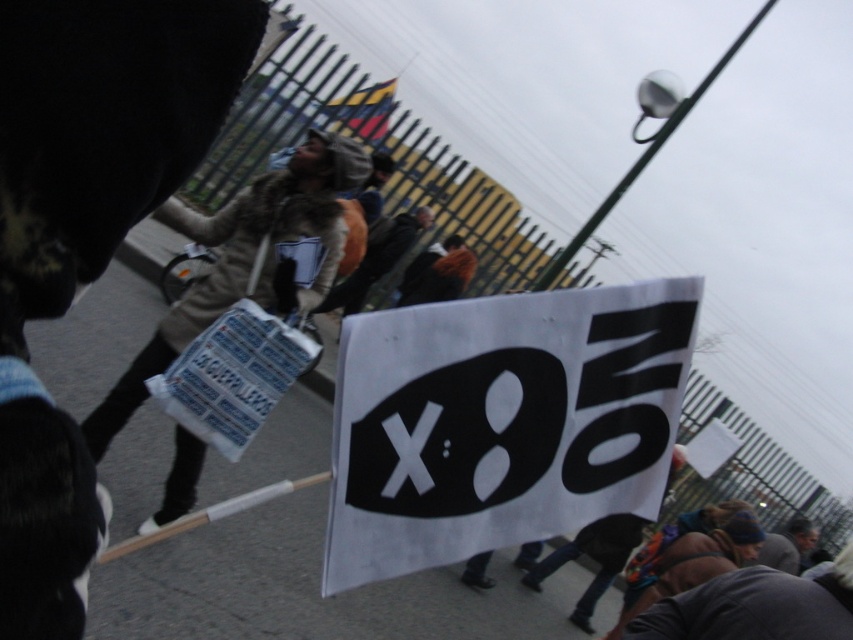
You are a photographer trying to capture the protest scene. You notice two points marked in the image. The first point is at coordinates point (393, 241) and the second is at point (788, 552). Which point is closer to your camera lens?

Point (393, 241) is further to the camera than point (788, 552), so the second point is closer to the camera lens.

You are a photographer standing at the scene. You want to capture a photo that includes both the brown fur coat at center and the dark gray fabric cap at lower right. What is the minimum distance you need to move backward to ensure both objects are in frame?

The brown fur coat at center and dark gray fabric cap at lower right are 4.19 meters apart. To include both in the frame, you need to move backward until your camera can capture a horizontal field of view of at least 4.19 meters. The exact distance depends on your camera lens, but generally, increasing distance decreases the required field of view proportionally.

You are a photographer at the protest scene. You need to capture a photo of both the beige fur coat at center and the brown fur coat at center in the same frame. Based on their positions, which coat should you focus on first to ensure both are in the frame?

The beige fur coat at center is located below the brown fur coat at center. To capture both in the same frame, focus on the brown fur coat at center first as it is higher up, ensuring the lower beige fur coat at center is also within the camera view.